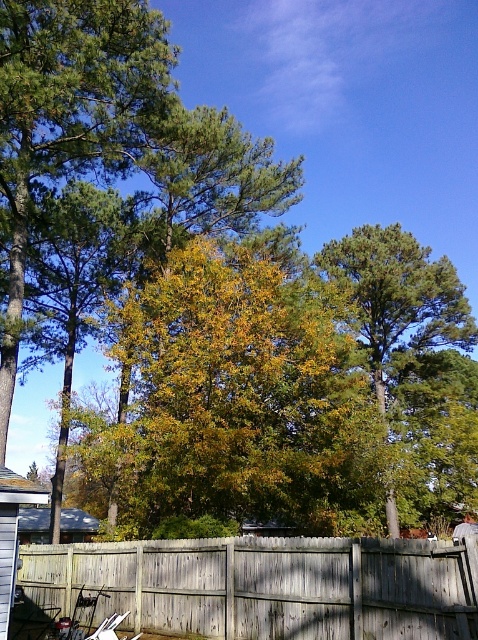
In the scene shown: Who is positioned more to the left, weathered wood fence at center or green leafy tree at center?

Positioned to the left is weathered wood fence at center.

Who is more forward, (306, 634) or (458, 305)?

Positioned in front is point (306, 634).

The image size is (478, 640). What are the coordinates of `weathered wood fence at center` in the screenshot? It's located at (268, 586).

Where is `weathered wood fence at center`? This screenshot has height=640, width=478. weathered wood fence at center is located at coordinates (268, 586).